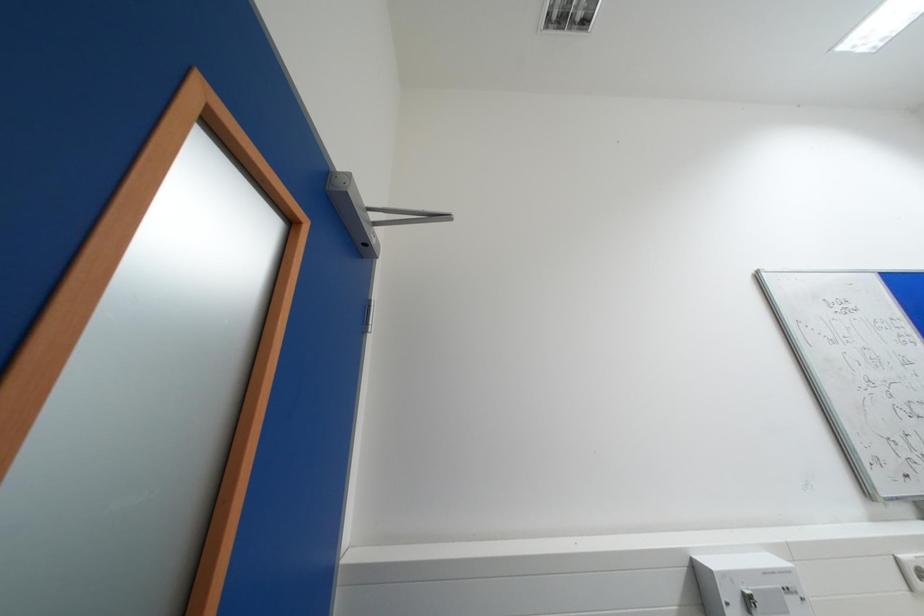
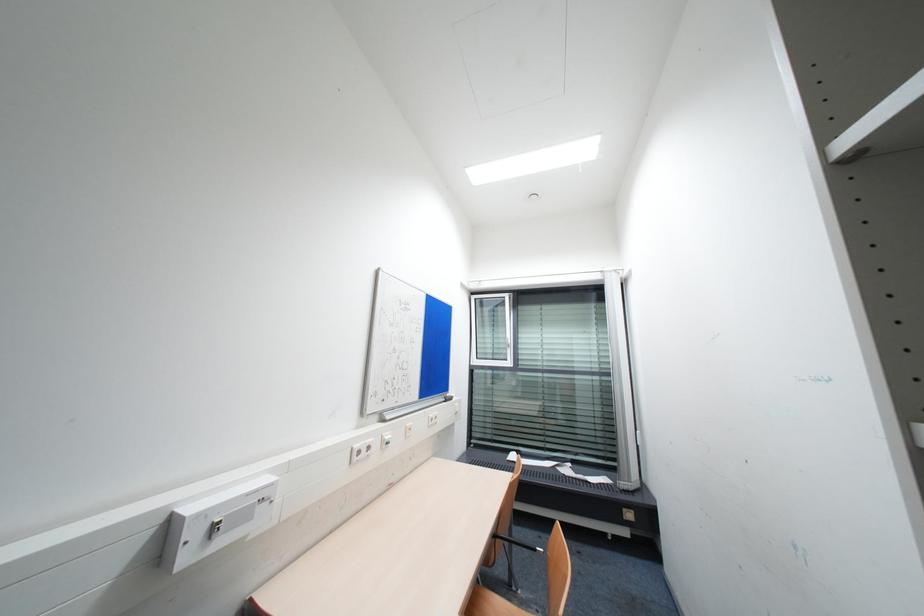
Question: The first image is from the beginning of the video and the second image is from the end. How did the camera likely rotate when shooting the video?

Choices:
 (A) Left
 (B) Right
 (C) Up
 (D) Down

Answer: (B)